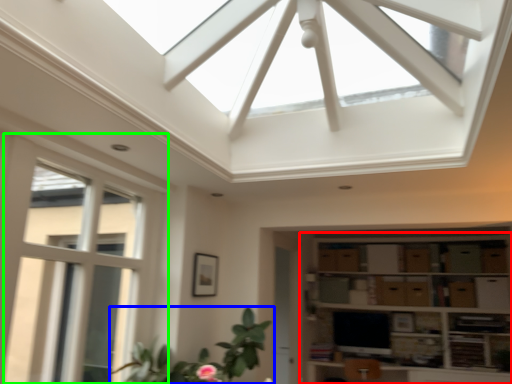
Question: Which object is the closest to the shelf (highlighted by a red box)? Choose among these: houseplant (highlighted by a blue box) or window (highlighted by a green box).

Choices:
 (A) houseplant
 (B) window

Answer: (A)